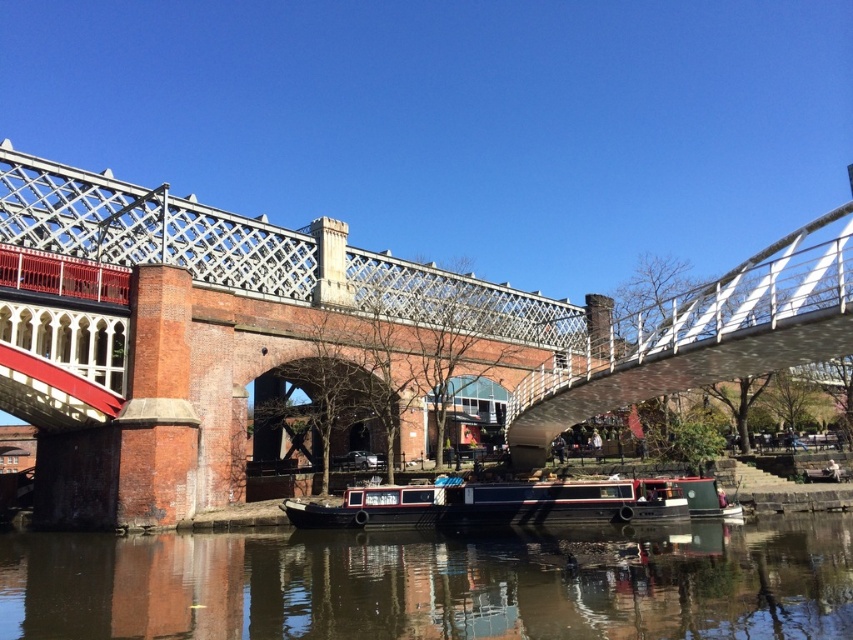
Does point (138, 589) lie behind point (474, 520)?

No, it is not.

Which of these two, brown reflective water at center or black polished wood boat at center, stands shorter?

Standing shorter between the two is brown reflective water at center.

Describe the element at coordinates (434, 584) in the screenshot. I see `brown reflective water at center` at that location.

In order to click on brown reflective water at center in this screenshot , I will do `click(434, 584)`.

Is metallic silver pedestrian bridge at center to the left of brown reflective water at center from the viewer's perspective?

No, metallic silver pedestrian bridge at center is not to the left of brown reflective water at center.

Consider the image. Is metallic silver pedestrian bridge at center thinner than brown reflective water at center?

No, metallic silver pedestrian bridge at center is not thinner than brown reflective water at center.

Is point (532, 433) closer to camera compared to point (514, 552)?

No.

Locate an element on the screen. metallic silver pedestrian bridge at center is located at coordinates (334, 332).

Is point (33, 212) positioned in front of point (460, 497)?

No, (33, 212) is further to viewer.

Who is positioned more to the left, metallic silver pedestrian bridge at center or black polished wood boat at center?

black polished wood boat at center is more to the left.

Who is more forward, (189,396) or (283,500)?

Positioned in front is point (283,500).

Find the location of a particular element. metallic silver pedestrian bridge at center is located at coordinates (334, 332).